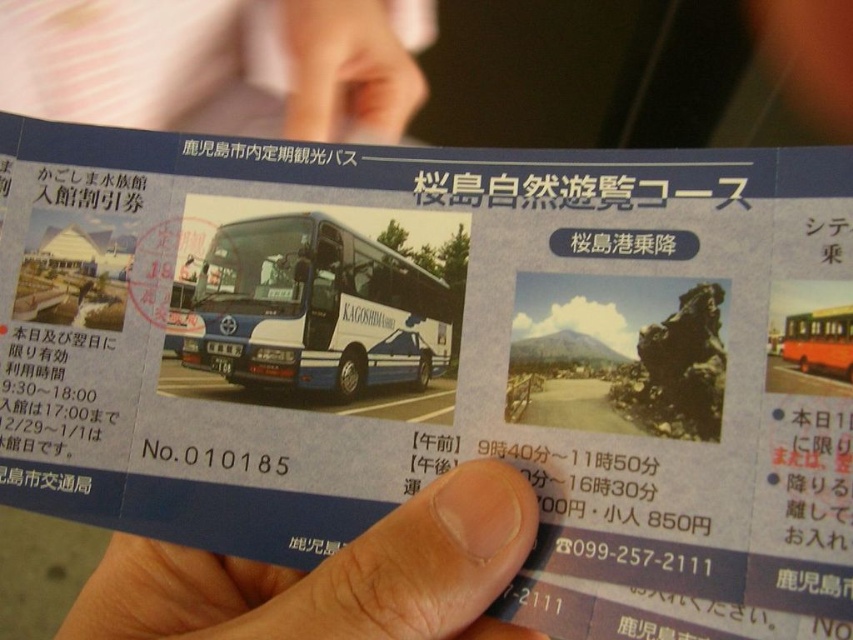
Based on the photo, which is more to the right, skinny white hand at upper center or orange matte bus at center?

orange matte bus at center

Does skinny white hand at upper center have a lesser width compared to orange matte bus at center?

No.

Does point (171, 120) come closer to viewer compared to point (837, 356)?

No, (171, 120) is behind (837, 356).

At what (x,y) coordinates should I click in order to perform the action: click on skinny white hand at upper center. Please return your answer as a coordinate pair (x, y). Looking at the image, I should click on (218, 64).

Does blue glossy bus at center lie behind orange matte bus at center?

Yes, it is.

Between point (346, 358) and point (822, 340), which one is positioned behind?

Point (346, 358)

Does point (267, 284) come in front of point (834, 369)?

No, (267, 284) is further to viewer.

Image resolution: width=853 pixels, height=640 pixels. Identify the location of blue glossy bus at center. (311, 308).

Which is below, skinny white hand at upper center or flesh-toned skin at lower center?

flesh-toned skin at lower center is lower down.

Which is more to the left, skinny white hand at upper center or flesh-toned skin at lower center?

skinny white hand at upper center

The width and height of the screenshot is (853, 640). What do you see at coordinates (218, 64) in the screenshot?
I see `skinny white hand at upper center` at bounding box center [218, 64].

Identify the location of skinny white hand at upper center. (218, 64).